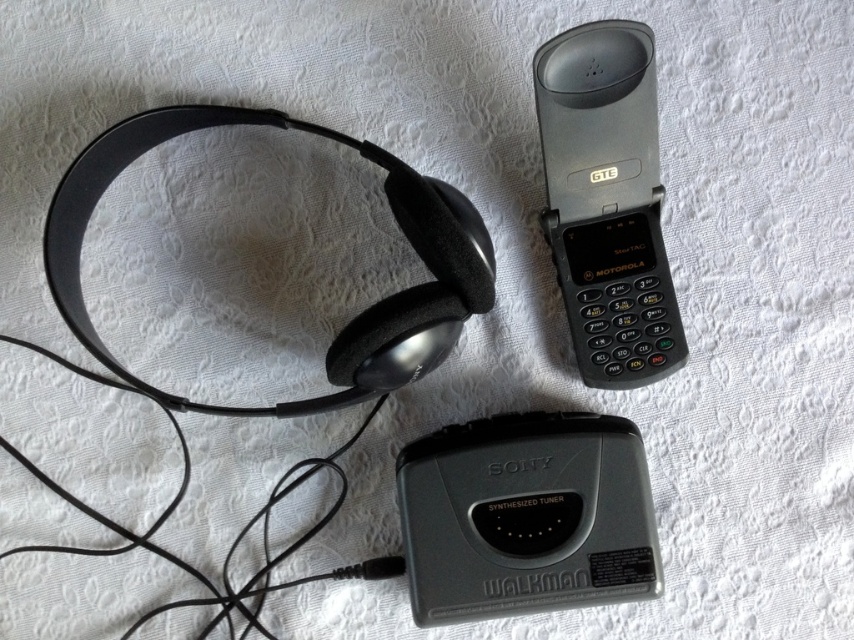
In the scene shown: You are organizing a vintage electronics exhibit and have limited space on a display shelf. You need to place both the gray matte walkman at center and the black plastic phone at upper right. Which device should you place first to ensure both fit on the shelf?

The gray matte walkman at center is smaller than the black plastic phone at upper right, so you should place the black plastic phone at upper right first to ensure both fit on the shelf.

You are a delivery person who needs to pack the black plastic phone at upper right and the matte black headphones at upper left into a box. The box has a height limit of 10 cm. Can both items fit vertically inside the box?

The black plastic phone at upper right is much taller than the matte black headphones at upper left. Since the box has a height limit of 10 cm, if the phone alone exceeds this height, it won